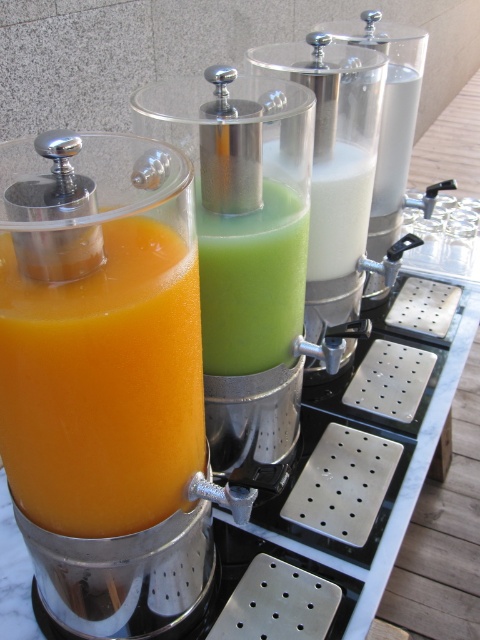
Which of these two, green matte juice at center or white matte milkshake at center, stands taller?

green matte juice at center is taller.

Does green matte juice at center appear on the left side of white matte milkshake at center?

Yes, green matte juice at center is to the left of white matte milkshake at center.

Locate an element on the screen. This screenshot has width=480, height=640. green matte juice at center is located at coordinates (252, 282).

Which is above, matte orange juice at left or white matte milkshake at center?

white matte milkshake at center is above.

The image size is (480, 640). Describe the element at coordinates (103, 385) in the screenshot. I see `matte orange juice at left` at that location.

Which is in front, point (109, 497) or point (367, 176)?

Point (109, 497) is more forward.

At what (x,y) coordinates should I click in order to perform the action: click on matte orange juice at left. Please return your answer as a coordinate pair (x, y). The height and width of the screenshot is (640, 480). Looking at the image, I should click on click(x=103, y=385).

Who is more forward, [189,477] or [220,241]?

Point [189,477] is more forward.

Between matte orange juice at left and green matte juice at center, which one is positioned higher?

Positioned higher is green matte juice at center.

Identify the location of matte orange juice at left. (103, 385).